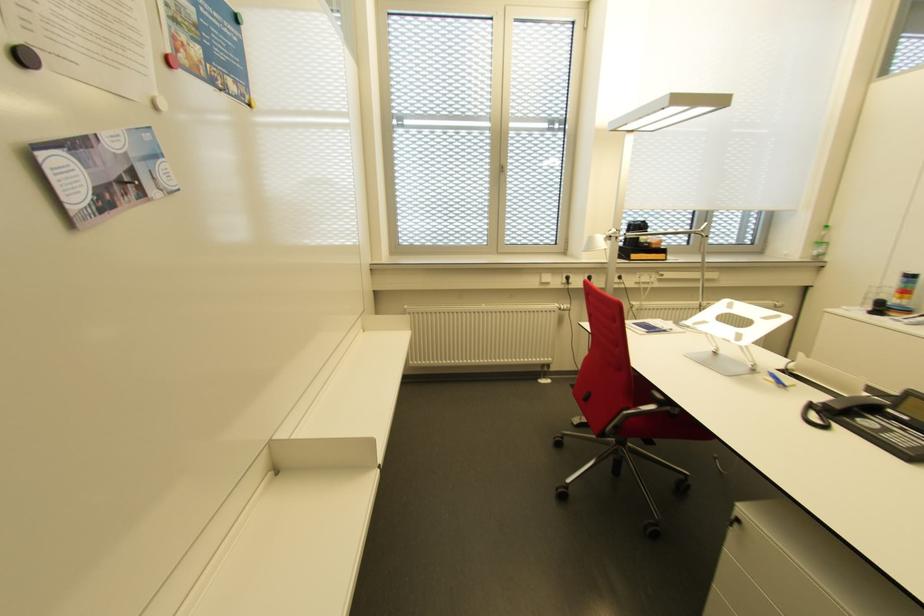
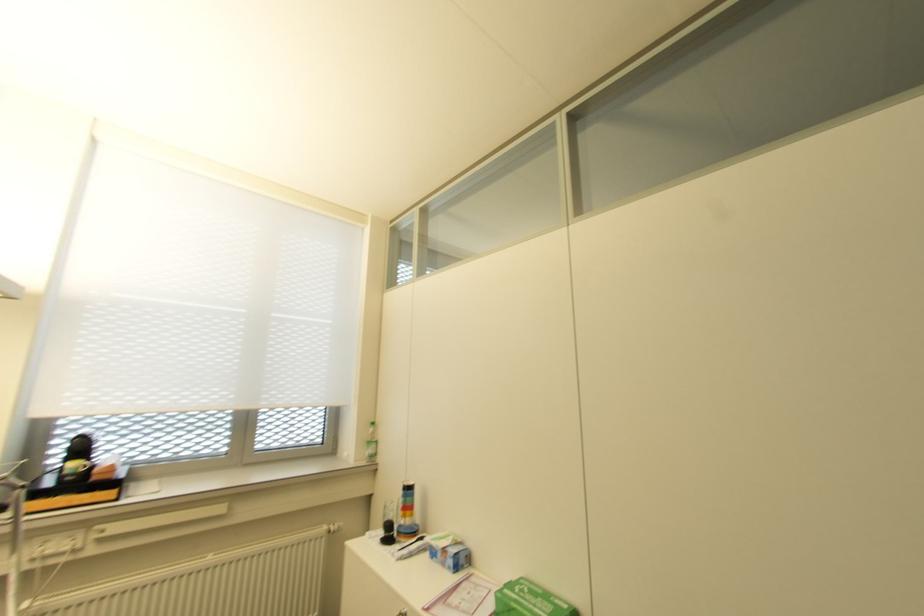
The point at [820,254] is marked in the first image. Where is the corresponding point in the second image?

(372, 455)